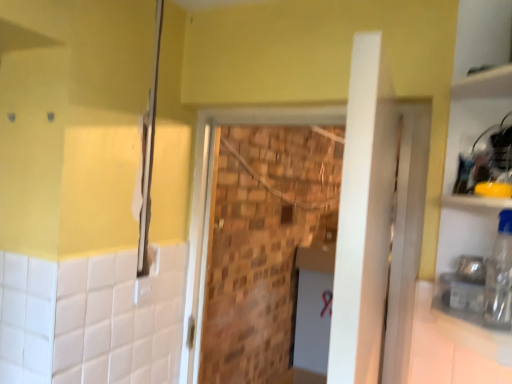
Locate an element on the screen. brick wall at center is located at coordinates click(379, 244).

The height and width of the screenshot is (384, 512). What do you see at coordinates (149, 152) in the screenshot?
I see `matte silver shower at left` at bounding box center [149, 152].

Consider the image. Measure the distance between point (498, 310) and camera.

Point (498, 310) and camera are 3.49 feet apart from each other.

What do you see at coordinates (455, 347) in the screenshot?
I see `white glossy counter top at lower right` at bounding box center [455, 347].

Locate an element on the screen. white glossy counter top at lower right is located at coordinates (455, 347).

This screenshot has height=384, width=512. In order to click on brick wall at center in this screenshot , I will do `click(379, 244)`.

Is white glossy counter top at lower right far from transparent plastic bottle at right?

Actually, white glossy counter top at lower right and transparent plastic bottle at right are a little close together.

From the image's perspective, is white glossy counter top at lower right located beneath transparent plastic bottle at right?

Indeed, from the image's perspective, white glossy counter top at lower right is shown beneath transparent plastic bottle at right.

Based on the photo, considering the sizes of objects white glossy counter top at lower right and transparent plastic bottle at right in the image provided, who is smaller, white glossy counter top at lower right or transparent plastic bottle at right?

transparent plastic bottle at right.

Can you confirm if white glossy counter top at lower right is positioned to the left of transparent plastic bottle at right?

No.

Is point (372, 367) closer or farther from the camera than point (153, 105)?

Clearly, point (372, 367) is closer to the camera than point (153, 105).

Is brick wall at center thinner than matte silver shower at left?

No.

Does brick wall at center appear on the left side of matte silver shower at left?

No.

Is brick wall at center touching white glossy counter top at lower right?

brick wall at center is not next to white glossy counter top at lower right, and they're not touching.

Looking at this image, from a real-world perspective, is brick wall at center physically located above or below white glossy counter top at lower right?

brick wall at center is below white glossy counter top at lower right.

From the image's perspective, between brick wall at center and white glossy counter top at lower right, which one is located above?

brick wall at center is shown above in the image.

Which object is positioned more to the right, brick wall at center or white glossy counter top at lower right?

From the viewer's perspective, white glossy counter top at lower right appears more on the right side.

Does white glossy counter top at lower right have a lesser width compared to matte silver shower at left?

No.

How different are the orientations of white glossy counter top at lower right and matte silver shower at left in degrees?

136 degrees.

Can you confirm if white glossy counter top at lower right is bigger than matte silver shower at left?

Indeed, white glossy counter top at lower right has a larger size compared to matte silver shower at left.

Would you say transparent plastic bottle at right is a long distance from brick wall at center?

That's not correct — transparent plastic bottle at right is a little close to brick wall at center.

Which of these two, transparent plastic bottle at right or brick wall at center, is thinner?

Thinner between the two is transparent plastic bottle at right.

Is transparent plastic bottle at right oriented towards brick wall at center?

No, transparent plastic bottle at right is not turned towards brick wall at center.

The width and height of the screenshot is (512, 384). In the image, there is a transparent plastic bottle at right. In order to click on screen door below it (from a real-world perspective) in this screenshot , I will do `click(379, 244)`.

In the image, is white glossy counter top at lower right positioned in front of or behind brick wall at center?

Visually, white glossy counter top at lower right is located in front of brick wall at center.

The height and width of the screenshot is (384, 512). What are the coordinates of `screen door below the white glossy counter top at lower right (from a real-world perspective)` in the screenshot? It's located at (379, 244).

Can you confirm if white glossy counter top at lower right is taller than brick wall at center?

No, white glossy counter top at lower right is not taller than brick wall at center.

Consider the image. How many degrees apart are the facing directions of transparent plastic bottle at right and white glossy counter top at lower right?

45.9 degrees.

From a real-world perspective, is transparent plastic bottle at right on white glossy counter top at lower right?

Yes, from a real-world perspective, transparent plastic bottle at right is above white glossy counter top at lower right.

Is point (508, 237) behind point (426, 315)?

No, it is not.

Locate an element on the screen. This screenshot has height=384, width=512. bottle positioned vertically above the white glossy counter top at lower right (from a real-world perspective) is located at coordinates (499, 276).

Locate an element on the screen. Image resolution: width=512 pixels, height=384 pixels. screen door that appears below the matte silver shower at left (from the image's perspective) is located at coordinates (379, 244).

In the scene shown: Which object lies further to the anchor point brick wall at center, white glossy counter top at lower right or matte silver shower at left?

Based on the image, matte silver shower at left appears to be further to brick wall at center.

Looking at the image, which one is located closer to matte silver shower at left, transparent plastic bottle at right or white glossy counter top at lower right?

white glossy counter top at lower right is positioned closer to the anchor matte silver shower at left.

Looking at the image, which one is located closer to white glossy counter top at lower right, matte silver shower at left or transparent plastic bottle at right?

Based on the image, transparent plastic bottle at right appears to be nearer to white glossy counter top at lower right.

Considering their positions, is brick wall at center positioned closer to matte silver shower at left than transparent plastic bottle at right?

Among the two, brick wall at center is located nearer to matte silver shower at left.

Looking at the image, which one is located closer to brick wall at center, transparent plastic bottle at right or matte silver shower at left?

Based on the image, transparent plastic bottle at right appears to be nearer to brick wall at center.

From the picture: Considering their positions, is white glossy counter top at lower right positioned further to transparent plastic bottle at right than brick wall at center?

Based on the image, brick wall at center appears to be further to transparent plastic bottle at right.

From the picture: Considering their positions, is brick wall at center positioned closer to white glossy counter top at lower right than transparent plastic bottle at right?

transparent plastic bottle at right is positioned closer to the anchor white glossy counter top at lower right.

Estimate the real-world distances between objects in this image. Which object is further from white glossy counter top at lower right, matte silver shower at left or brick wall at center?

matte silver shower at left.

You are a GUI agent. You are given a task and a screenshot of the screen. Output one action in this format:
    pyautogui.click(x=<x>, y=<y>)
    Task: Click on the bottle between matte silver shower at left and white glossy counter top at lower right
    
    Given the screenshot: What is the action you would take?
    pyautogui.click(x=499, y=276)

What are the coordinates of `screen door located between matte silver shower at left and white glossy counter top at lower right in the left-right direction` in the screenshot? It's located at (379, 244).

You are a GUI agent. You are given a task and a screenshot of the screen. Output one action in this format:
    pyautogui.click(x=<x>, y=<y>)
    Task: Click on the bottle between white glossy counter top at lower right and brick wall at center in the front-back direction
    The height and width of the screenshot is (384, 512).
    Given the screenshot: What is the action you would take?
    pyautogui.click(x=499, y=276)

This screenshot has width=512, height=384. What are the coordinates of `screen door located between matte silver shower at left and transparent plastic bottle at right in the left-right direction` in the screenshot? It's located at (379, 244).